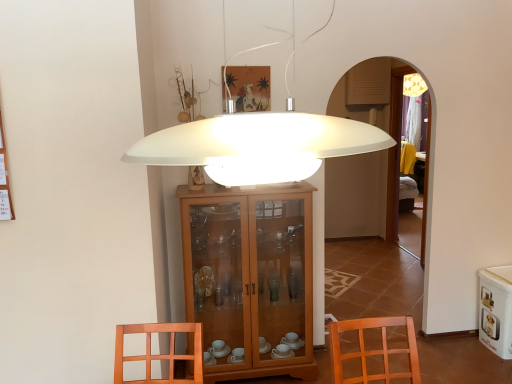
Question: Is white glossy pet food container at lower right in front of or behind matte wooden picture frame at upper center in the image?

Choices:
 (A) behind
 (B) front

Answer: (A)

Question: From a real-world perspective, is white glossy pet food container at lower right physically located above or below matte wooden picture frame at upper center?

Choices:
 (A) above
 (B) below

Answer: (B)

Question: Considering the real-world distances, which object is farthest from the wooden cabinet at center?

Choices:
 (A) white matte lampshade at center
 (B) matte wooden picture frame at upper center
 (C) white glossy pet food container at lower right

Answer: (A)

Question: Which of these objects is positioned farthest from the white glossy pet food container at lower right?

Choices:
 (A) white matte lampshade at center
 (B) matte wooden picture frame at upper center
 (C) wooden cabinet at center

Answer: (A)